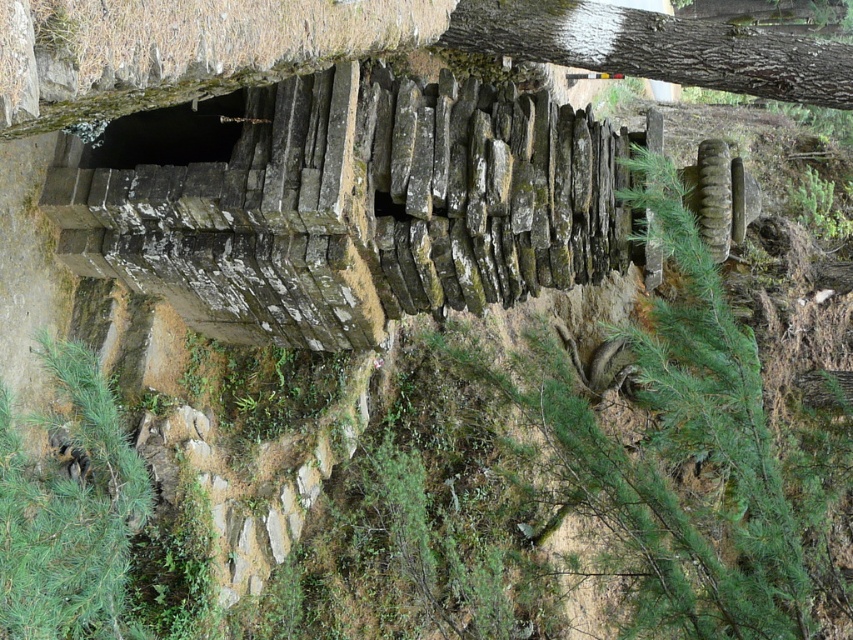
You are an architect examining the stone structure. You need to compare the sizes of the green mossy stone at center and the smooth bark tree trunk at upper right. Which one is bigger?

The green mossy stone at center is larger in size than the smooth bark tree trunk at upper right.